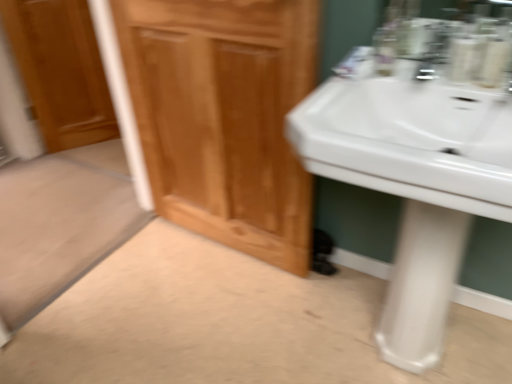
Find the location of a particular element. vacant region under wooden cabinet at center (from a real-world perspective) is located at coordinates (222, 248).